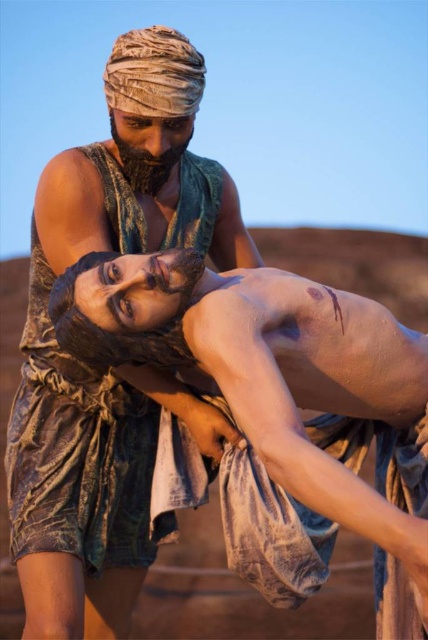
You are a photographer trying to capture the two points in the scene. Which point, point [419,468] or point [202,68], will appear larger in your photo?

Point [419,468] is closer to the camera than point [202,68], so it will appear larger in the photo.